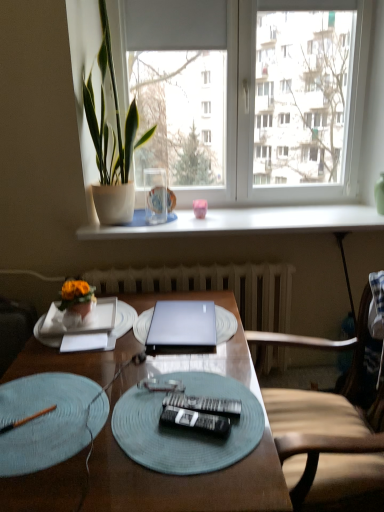
From the picture: How much space does black plastic remote control at center, marked as the second remote control in a back-to-front arrangement, occupy vertically?

black plastic remote control at center, marked as the second remote control in a back-to-front arrangement, is 0.91 inches in height.

What do you see at coordinates (26, 419) in the screenshot?
I see `orange wood pen at lower left` at bounding box center [26, 419].

What are the coordinates of `orange wood pen at lower left` in the screenshot? It's located at (26, 419).

The height and width of the screenshot is (512, 384). Identify the location of white glossy window sill at upper center. (248, 222).

Find the location of a particular element. wooden desk at center is located at coordinates (187, 476).

The height and width of the screenshot is (512, 384). Describe the element at coordinates (48, 420) in the screenshot. I see `light blue textured placemat at lower left` at that location.

The width and height of the screenshot is (384, 512). I want to click on black plastic remote control at center, marked as the second remote control in a back-to-front arrangement, so click(x=195, y=421).

How different are the orientations of white metallic radiator at center and wooden at right in degrees?

They differ by 88.8 degrees in their facing directions.

Is white metallic radiator at center in front of or behind wooden at right in the image?

white metallic radiator at center is behind wooden at right.

Which is behind, point (125, 290) or point (377, 435)?

The point (125, 290) is more distant.

Considering their positions, is white glossy window sill at upper center located in front of or behind orange wood pen at lower left?

Visually, white glossy window sill at upper center is located behind orange wood pen at lower left.

Is white glossy window sill at upper center looking in the opposite direction of orange wood pen at lower left?

No, white glossy window sill at upper center is not facing the opposite direction of orange wood pen at lower left.

How different are the orientations of white glossy window sill at upper center and orange wood pen at lower left in degrees?

The angle between the facing direction of white glossy window sill at upper center and the facing direction of orange wood pen at lower left is 39 degrees.

Looking at the image, does white glossy window sill at upper center seem bigger or smaller compared to orange wood pen at lower left?

Considering their sizes, white glossy window sill at upper center takes up more space than orange wood pen at lower left.

Is orange wood pen at lower left at the right side of pink matte coffee cup at center?

No, orange wood pen at lower left is not to the right of pink matte coffee cup at center.

From the picture: Can you confirm if orange wood pen at lower left is thinner than pink matte coffee cup at center?

Yes, orange wood pen at lower left is thinner than pink matte coffee cup at center.

From the image's perspective, between orange wood pen at lower left and pink matte coffee cup at center, which one is located above?

pink matte coffee cup at center appears higher in the image.

Is orange wood pen at lower left facing away from pink matte coffee cup at center?

orange wood pen at lower left is not turned away from pink matte coffee cup at center.

Is black plastic remote control at center, which is counted as the first remote control, starting from the back, not near white paper at center?

They are positioned close to each other.

Is point (197, 410) more distant than point (109, 348)?

That is False.

Could you tell me if black plastic remote control at center, which ranks as the second remote control in front-to-back order, is turned towards white paper at center?

No, black plastic remote control at center, which ranks as the second remote control in front-to-back order, is not turned towards white paper at center.

Considering their positions, is black plastic remote control at center, which is counted as the first remote control, starting from the back, located in front of or behind white paper at center?

In the image, black plastic remote control at center, which is counted as the first remote control, starting from the back, appears in front of white paper at center.

Between point (344, 5) and point (33, 418), which one is positioned in front?

The point (33, 418) is closer.

Are white plastic window at upper center and orange wood pen at lower left located far from each other?

Yes, white plastic window at upper center is far from orange wood pen at lower left.

Does white plastic window at upper center turn towards orange wood pen at lower left?

Yes, white plastic window at upper center is turned towards orange wood pen at lower left.

In terms of height, does white plastic window at upper center look taller or shorter compared to orange wood pen at lower left?

Clearly, white plastic window at upper center is taller compared to orange wood pen at lower left.

Could you tell me if black plastic remote control at center, which ranks as the second remote control in front-to-back order, is turned towards wooden at right?

No, black plastic remote control at center, which ranks as the second remote control in front-to-back order, is not turned towards wooden at right.

Which object is further away from the camera, black plastic remote control at center, which is counted as the first remote control, starting from the back, or wooden at right?

black plastic remote control at center, which is counted as the first remote control, starting from the back, is more distant.

Can we say black plastic remote control at center, which is counted as the first remote control, starting from the back, lies outside wooden at right?

black plastic remote control at center, which is counted as the first remote control, starting from the back, lies outside wooden at right's area.

From a real-world perspective, who is located higher, black plastic remote control at center, which ranks as the second remote control in front-to-back order, or wooden at right?

From a 3D spatial view, black plastic remote control at center, which ranks as the second remote control in front-to-back order, is above.

Would you say wooden at right is a long distance from wooden desk at center?

wooden at right is near wooden desk at center, not far away.

Is wooden at right facing away from wooden desk at center?

No, wooden at right is not facing the opposite direction of wooden desk at center.

Is point (360, 477) positioned before point (250, 378)?

Yes, it is.

Locate an element on the screen. Image resolution: width=384 pixels, height=512 pixels. chair below the white metallic radiator at center (from the image's perspective) is located at coordinates (327, 432).

Find the location of a particular element. pen on the left of the white glossy window sill at upper center is located at coordinates (26, 419).

When comparing their distances from wooden desk at center, does light blue textured placemat at lower left or black plastic remote control at center, which is counted as the first remote control, starting from the back, seem closer?

Based on the image, light blue textured placemat at lower left appears to be nearer to wooden desk at center.

Looking at the image, which one is located further to white glossy window sill at upper center, black plastic remote control at center, marked as the second remote control in a back-to-front arrangement, or silver metallic laptop at center?

black plastic remote control at center, marked as the second remote control in a back-to-front arrangement, lies further to white glossy window sill at upper center than the other object.

Looking at the image, which one is located closer to white paper at left, white metallic radiator at center or wooden desk at center?

Based on the image, wooden desk at center appears to be nearer to white paper at left.

From the image, which object appears to be farther from white plastic window at upper center, light blue textured placemat at lower left or black plastic remote control at center, which ranks as the second remote control in front-to-back order?

The object further to white plastic window at upper center is black plastic remote control at center, which ranks as the second remote control in front-to-back order.

From the image, which object appears to be nearer to wooden desk at center, wooden at right or white plastic window at upper center?

wooden at right is positioned closer to the anchor wooden desk at center.

From the image, which object appears to be nearer to green leafy plant at left, light blue textured placemat at lower left or silver metallic laptop at center?

silver metallic laptop at center is closer to green leafy plant at left.

Estimate the real-world distances between objects in this image. Which object is closer to white glossy window sill at upper center, white plastic window at upper center or matte green placemat at center?

white plastic window at upper center lies closer to white glossy window sill at upper center than the other object.

Based on their spatial positions, is light blue textured placemat at lower left or white glossy window sill at upper center closer to wooden desk at center?

light blue textured placemat at lower left.

Locate an element on the screen. Image resolution: width=384 pixels, height=512 pixels. laptop that lies between white plastic window at upper center and black plastic remote control at center, which ranks as the second remote control in front-to-back order, from top to bottom is located at coordinates (182, 324).

At what (x,y) coordinates should I click in order to perform the action: click on laptop between orange wood pen at lower left and wooden at right. Please return your answer as a coordinate pair (x, y). Looking at the image, I should click on tap(182, 324).

Locate an element on the screen. This screenshot has width=384, height=512. remote control positioned between black plastic remote control at center, marked as the second remote control in a back-to-front arrangement, and white paper at center from near to far is located at coordinates (203, 404).

Locate an element on the screen. The height and width of the screenshot is (512, 384). window sill between green leafy plant at left and wooden at right vertically is located at coordinates (248, 222).